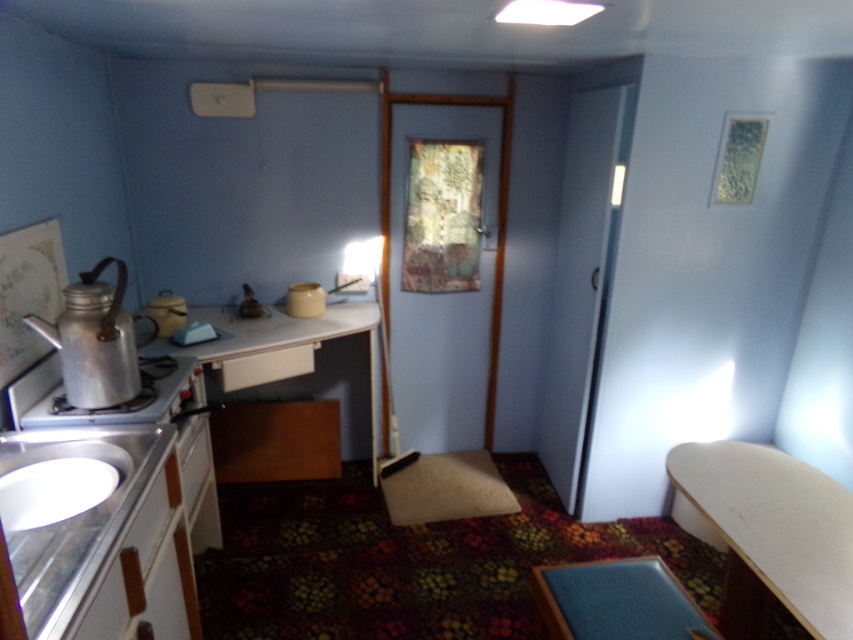
Is wooden table at center smaller than silver metallic stove at lower left?

No.

Who is positioned more to the left, wooden table at center or silver metallic stove at lower left?

From the viewer's perspective, silver metallic stove at lower left appears more on the left side.

This screenshot has width=853, height=640. Identify the location of wooden table at center. (281, 349).

Who is positioned more to the right, metallic teapot at left or silver metallic stove at lower left?

silver metallic stove at lower left is more to the right.

Can you confirm if metallic teapot at left is thinner than silver metallic stove at lower left?

Incorrect, metallic teapot at left's width is not less than silver metallic stove at lower left's.

In the scene shown: Who is more forward, (114,298) or (41,420)?

Point (114,298) is in front.

I want to click on metallic teapot at left, so click(x=94, y=340).

Who is lower down, wooden table at center or white glossy sink at lower left?

Positioned lower is white glossy sink at lower left.

Does wooden table at center come in front of white glossy sink at lower left?

No.

The image size is (853, 640). I want to click on wooden table at center, so click(x=281, y=349).